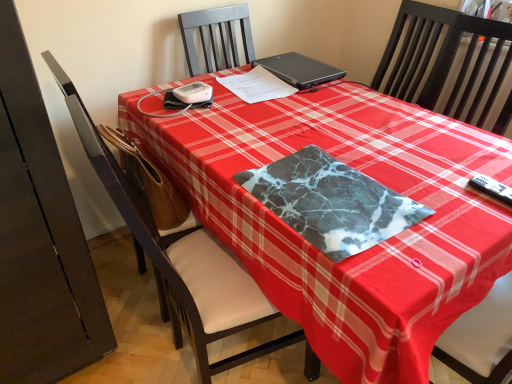
What is the approximate width of black wood chair at center?

The width of black wood chair at center is 58.04 centimeters.

Where is `black plastic remote control at lower right`? black plastic remote control at lower right is located at coordinates (492, 189).

Find the location of a particular element. The image size is (512, 384). black matte laptop at upper center is located at coordinates (298, 70).

Which is more to the right, black plastic remote control at lower right or marble-like fabric at center?

Positioned to the right is black plastic remote control at lower right.

How many degrees apart are the facing directions of black plastic remote control at lower right and marble-like fabric at center?

90 degrees separate the facing orientations of black plastic remote control at lower right and marble-like fabric at center.

Is black plastic remote control at lower right far away from marble-like fabric at center?

No, black plastic remote control at lower right is not far from marble-like fabric at center.

From a real-world perspective, is black plastic remote control at lower right over marble-like fabric at center?

Actually, black plastic remote control at lower right is physically below marble-like fabric at center in the real world.

Can you confirm if brown leather swivel chair at left is wider than white paper at center?

In fact, brown leather swivel chair at left might be narrower than white paper at center.

Which is in front, point (66, 91) or point (247, 97)?

Positioned in front is point (66, 91).

Is brown leather swivel chair at left with white paper at center?

brown leather swivel chair at left and white paper at center are not in contact.

Measure the distance between white paper at center and black wood chair at center.

They are 80.14 centimeters apart.

What's the angular difference between white paper at center and black wood chair at center's facing directions?

79.8 degrees.

Does white paper at center have a lesser width compared to black wood chair at center?

Indeed, white paper at center has a lesser width compared to black wood chair at center.

Between white paper at center and black wood chair at center, which one is positioned in front?

Positioned in front is black wood chair at center.

Is marble-like fabric at center situated inside black wood chair at center or outside?

marble-like fabric at center exists outside the volume of black wood chair at center.

Consider the image. Is marble-like fabric at center aimed at black wood chair at center?

No, marble-like fabric at center is not facing towards black wood chair at center.

From the image's perspective, would you say marble-like fabric at center is shown under black wood chair at center?

Correct, marble-like fabric at center appears lower than black wood chair at center in the image.

Considering the positions of objects marble-like fabric at center and black wood chair at center in the image provided, who is in front, marble-like fabric at center or black wood chair at center?

marble-like fabric at center is in front.

Which is further, (110, 195) or (303, 80)?

Positioned behind is point (303, 80).

In the scene shown: Is brown leather swivel chair at left outside of black matte laptop at upper center?

brown leather swivel chair at left is positioned outside black matte laptop at upper center.

Between brown leather swivel chair at left and black matte laptop at upper center, which one has larger size?

With larger size is brown leather swivel chair at left.

From a real-world perspective, is brown leather swivel chair at left under black matte laptop at upper center?

Yes, from a real-world perspective, brown leather swivel chair at left is below black matte laptop at upper center.

Is black plastic remote control at lower right shorter than brown leather swivel chair at left?

Yes.

From a real-world perspective, is black plastic remote control at lower right under brown leather swivel chair at left?

Incorrect, from a real-world perspective, black plastic remote control at lower right is higher than brown leather swivel chair at left.

Which is in front, point (490, 181) or point (143, 269)?

The point (490, 181) is closer to the camera.

How different are the orientations of black plastic remote control at lower right and brown leather swivel chair at left in degrees?

The angular difference between black plastic remote control at lower right and brown leather swivel chair at left is 90 degrees.

What's the angular difference between black wood chair at center and brown leather swivel chair at left's facing directions?

black wood chair at center and brown leather swivel chair at left are facing 177 degrees away from each other.

Could you tell me if black wood chair at center is turned towards brown leather swivel chair at left?

Yes, black wood chair at center is oriented towards brown leather swivel chair at left.

From a real-world perspective, is black wood chair at center positioned above or below brown leather swivel chair at left?

From a real-world perspective, black wood chair at center is physically above brown leather swivel chair at left.

Is point (487, 24) less distant than point (135, 242)?

Yes, it is.

Where is `blanket above the black plastic remote control at lower right (from the image's perspective)`? The width and height of the screenshot is (512, 384). blanket above the black plastic remote control at lower right (from the image's perspective) is located at coordinates (331, 202).

Locate an element on the screen. Image resolution: width=512 pixels, height=384 pixels. notepad behind the brown leather swivel chair at left is located at coordinates (257, 86).

Based on their spatial positions, is black plastic remote control at lower right or black wood chair at center closer to white paper at center?

Based on the image, black wood chair at center appears to be nearer to white paper at center.

In the scene shown: Estimate the real-world distances between objects in this image. Which object is further from black plastic remote control at lower right, black wood chair at center or marble-like fabric at center?

black wood chair at center lies further to black plastic remote control at lower right than the other object.

When comparing their distances from marble-like fabric at center, does brown leather swivel chair at left or white paper at center seem further?

Among the two, white paper at center is located further to marble-like fabric at center.

Based on their spatial positions, is brown leather swivel chair at left or black matte laptop at upper center further from white paper at center?

brown leather swivel chair at left.

Estimate the real-world distances between objects in this image. Which object is closer to black wood chair at center, brown leather swivel chair at left or black matte laptop at upper center?

Based on the image, black matte laptop at upper center appears to be nearer to black wood chair at center.

Looking at the image, which one is located further to black matte laptop at upper center, white paper at center or black plastic remote control at lower right?

Based on the image, black plastic remote control at lower right appears to be further to black matte laptop at upper center.

Estimate the real-world distances between objects in this image. Which object is further from brown leather swivel chair at left, white paper at center or black plastic remote control at lower right?

black plastic remote control at lower right is further to brown leather swivel chair at left.

Which object lies further to the anchor point black plastic remote control at lower right, black wood chair at center or black matte laptop at upper center?

Based on the image, black wood chair at center appears to be further to black plastic remote control at lower right.

Image resolution: width=512 pixels, height=384 pixels. I want to click on remote control between marble-like fabric at center and black wood chair at center, so click(492, 189).

At what (x,y) coordinates should I click in order to perform the action: click on blanket between brown leather swivel chair at left and black plastic remote control at lower right from left to right. Please return your answer as a coordinate pair (x, y). The image size is (512, 384). Looking at the image, I should click on (331, 202).

Locate an element on the screen. The image size is (512, 384). remote control between white paper at center and black wood chair at center in the horizontal direction is located at coordinates (492, 189).

Where is `laptop situated between white paper at center and black wood chair at center from left to right`? This screenshot has height=384, width=512. laptop situated between white paper at center and black wood chair at center from left to right is located at coordinates (298, 70).